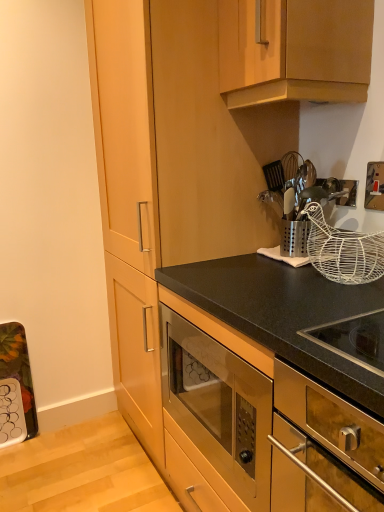
The width and height of the screenshot is (384, 512). What do you see at coordinates (374, 186) in the screenshot?
I see `gold metallic switch at upper right` at bounding box center [374, 186].

Where is `stainless steel oven at lower right`? stainless steel oven at lower right is located at coordinates (323, 449).

From the image's perspective, which is above, metallic silver utensil holder at upper right or wooden cabinet at upper center, the 2th cabinetry ordered from the bottom?

wooden cabinet at upper center, the 2th cabinetry ordered from the bottom, is shown above in the image.

Which point is more distant from viewer, (334, 183) or (353, 50)?

The point (334, 183) is behind.

At what (x,y) coordinates should I click in order to perform the action: click on appliance below the wooden cabinet at upper center, the 2th cabinetry ordered from the bottom (from the image's perspective). Please return your answer as a coordinate pair (x, y). The width and height of the screenshot is (384, 512). Looking at the image, I should click on 299,198.

In the scene shown: Is metallic silver utensil holder at upper right situated inside wooden cabinet at upper center, positioned as the 1th cabinetry in top-to-bottom order, or outside?

metallic silver utensil holder at upper right is located beyond the bounds of wooden cabinet at upper center, positioned as the 1th cabinetry in top-to-bottom order.

Between wooden cabinet at upper center, positioned as the 1th cabinetry in top-to-bottom order, and white wire basket at upper right, which one is positioned behind?

white wire basket at upper right is further away from the camera.

Considering the positions of points (238, 101) and (330, 248), is point (238, 101) farther from camera compared to point (330, 248)?

Yes, it is.

Considering the relative sizes of wooden cabinet at upper center, the 2th cabinetry ordered from the bottom, and white wire basket at upper right in the image provided, is wooden cabinet at upper center, the 2th cabinetry ordered from the bottom, wider than white wire basket at upper right?

Yes.

Looking at this image, is wooden cabinet at upper center, the 2th cabinetry ordered from the bottom, not near white wire basket at upper right?

That's not correct — wooden cabinet at upper center, the 2th cabinetry ordered from the bottom, is a little close to white wire basket at upper right.

Identify the location of cabinetry above the white wire basket at upper right (from a real-world perspective). This screenshot has height=512, width=384. (301, 51).

Measure the distance from white wire basket at upper right to wooden cabinet at upper center, positioned as the 1th cabinetry in top-to-bottom order.

17.57 inches.

Considering the positions of objects white wire basket at upper right and wooden cabinet at upper center, the 2th cabinetry ordered from the bottom, in the image provided, who is more to the left, white wire basket at upper right or wooden cabinet at upper center, the 2th cabinetry ordered from the bottom,?

From the viewer's perspective, wooden cabinet at upper center, the 2th cabinetry ordered from the bottom, appears more on the left side.

Is white wire basket at upper right facing away from wooden cabinet at upper center, positioned as the 1th cabinetry in top-to-bottom order?

No, white wire basket at upper right is not facing away from wooden cabinet at upper center, positioned as the 1th cabinetry in top-to-bottom order.

Based on the photo, is wooden cabinet at upper center, the 2th cabinetry ordered from the bottom, not within stainless steel oven at center, placed as the 1th cabinetry when sorted from bottom to top?

Absolutely, wooden cabinet at upper center, the 2th cabinetry ordered from the bottom, is external to stainless steel oven at center, placed as the 1th cabinetry when sorted from bottom to top.

In the scene shown: Would you say wooden cabinet at upper center, positioned as the 1th cabinetry in top-to-bottom order, is a long distance from stainless steel oven at center, placed as the 1th cabinetry when sorted from bottom to top?

wooden cabinet at upper center, positioned as the 1th cabinetry in top-to-bottom order, is actually quite close to stainless steel oven at center, placed as the 1th cabinetry when sorted from bottom to top.

From the picture: Is wooden cabinet at upper center, the 2th cabinetry ordered from the bottom, in front of or behind stainless steel oven at center, placed as the 1th cabinetry when sorted from bottom to top, in the image?

Clearly, wooden cabinet at upper center, the 2th cabinetry ordered from the bottom, is behind stainless steel oven at center, placed as the 1th cabinetry when sorted from bottom to top.

In the image, is stainless steel oven at center, which is the 2th cabinetry in top-to-bottom order, positioned in front of or behind white wire basket at upper right?

stainless steel oven at center, which is the 2th cabinetry in top-to-bottom order, is in front of white wire basket at upper right.

Which is more distant, (315, 280) or (381, 249)?

Positioned behind is point (315, 280).

Can you confirm if stainless steel oven at center, placed as the 1th cabinetry when sorted from bottom to top, is positioned to the right of white wire basket at upper right?

Result: Incorrect, stainless steel oven at center, placed as the 1th cabinetry when sorted from bottom to top, is not on the right side of white wire basket at upper right.

In the scene shown: What's the angular difference between stainless steel oven at center, which is the 2th cabinetry in top-to-bottom order, and wooden cabinet at upper center, the 2th cabinetry ordered from the bottom,'s facing directions?

0.412 degrees separate the facing orientations of stainless steel oven at center, which is the 2th cabinetry in top-to-bottom order, and wooden cabinet at upper center, the 2th cabinetry ordered from the bottom.

Between stainless steel oven at center, which is the 2th cabinetry in top-to-bottom order, and wooden cabinet at upper center, the 2th cabinetry ordered from the bottom, which one is positioned in front?

stainless steel oven at center, which is the 2th cabinetry in top-to-bottom order, is in front.

Considering the relative positions of stainless steel oven at center, placed as the 1th cabinetry when sorted from bottom to top, and wooden cabinet at upper center, positioned as the 1th cabinetry in top-to-bottom order, in the image provided, is stainless steel oven at center, placed as the 1th cabinetry when sorted from bottom to top, to the left or to the right of wooden cabinet at upper center, positioned as the 1th cabinetry in top-to-bottom order,?

stainless steel oven at center, placed as the 1th cabinetry when sorted from bottom to top, is positioned on wooden cabinet at upper center, positioned as the 1th cabinetry in top-to-bottom order,'s left side.

Considering the relative sizes of stainless steel oven at center, which is the 2th cabinetry in top-to-bottom order, and wooden cabinet at upper center, the 2th cabinetry ordered from the bottom, in the image provided, is stainless steel oven at center, which is the 2th cabinetry in top-to-bottom order, thinner than wooden cabinet at upper center, the 2th cabinetry ordered from the bottom,?

Yes.

Based on the photo, is gold metallic switch at upper right facing away from white wire basket at upper right?

No, gold metallic switch at upper right's orientation is not away from white wire basket at upper right.

From the image's perspective, which object appears higher, gold metallic switch at upper right or white wire basket at upper right?

gold metallic switch at upper right appears higher in the image.

Is gold metallic switch at upper right further to camera compared to white wire basket at upper right?

Yes.

Locate an element on the screen. cabinetry that is the 1st one when counting forward from the metallic silver utensil holder at upper right is located at coordinates (301, 51).

What are the coordinates of `cabinetry above the white wire basket at upper right (from a real-world perspective)` in the screenshot? It's located at (301, 51).

When comparing their distances from stainless steel oven at lower right, does wooden cabinet at upper center, the 2th cabinetry ordered from the bottom, or stainless steel oven at center, placed as the 1th cabinetry when sorted from bottom to top, seem closer?

stainless steel oven at center, placed as the 1th cabinetry when sorted from bottom to top.

Considering their positions, is wooden cabinet at upper center, positioned as the 1th cabinetry in top-to-bottom order, positioned closer to metallic silver utensil holder at upper right than gold metallic switch at upper right?

gold metallic switch at upper right is closer to metallic silver utensil holder at upper right.

Considering their positions, is stainless steel oven at center, which is the 2th cabinetry in top-to-bottom order, positioned closer to stainless steel oven at lower right than metallic silver utensil holder at upper right?

Among the two, stainless steel oven at center, which is the 2th cabinetry in top-to-bottom order, is located nearer to stainless steel oven at lower right.

Estimate the real-world distances between objects in this image. Which object is closer to stainless steel oven at center, which is the 2th cabinetry in top-to-bottom order, white wire basket at upper right or metallic silver utensil holder at upper right?

white wire basket at upper right is closer to stainless steel oven at center, which is the 2th cabinetry in top-to-bottom order.

Looking at this image, looking at the image, which one is located closer to white wire basket at upper right, stainless steel oven at center, placed as the 1th cabinetry when sorted from bottom to top, or metallic silver utensil holder at upper right?

metallic silver utensil holder at upper right lies closer to white wire basket at upper right than the other object.

Considering their positions, is gold metallic switch at upper right positioned further to wooden cabinet at upper center, positioned as the 1th cabinetry in top-to-bottom order, than metallic silver utensil holder at upper right?

gold metallic switch at upper right is positioned further to the anchor wooden cabinet at upper center, positioned as the 1th cabinetry in top-to-bottom order.

When comparing their distances from metallic silver utensil holder at upper right, does white wire basket at upper right or wooden cabinet at upper center, the 2th cabinetry ordered from the bottom, seem closer?

The object closer to metallic silver utensil holder at upper right is white wire basket at upper right.

Looking at the image, which one is located further to stainless steel oven at lower right, stainless steel oven at center, which is the 2th cabinetry in top-to-bottom order, or white wire basket at upper right?

Based on the image, white wire basket at upper right appears to be further to stainless steel oven at lower right.

You are a GUI agent. You are given a task and a screenshot of the screen. Output one action in this format:
    pyautogui.click(x=<x>, y=<y>)
    Task: Click on the basket between metallic silver utensil holder at upper right and stainless steel oven at center, placed as the 1th cabinetry when sorted from bottom to top, in the up-down direction
    The width and height of the screenshot is (384, 512).
    Given the screenshot: What is the action you would take?
    (x=343, y=251)

Find the location of `appliance between gold metallic switch at upper right and stainless steel oven at center, placed as the 1th cabinetry when sorted from bottom to top, in the up-down direction`. appliance between gold metallic switch at upper right and stainless steel oven at center, placed as the 1th cabinetry when sorted from bottom to top, in the up-down direction is located at coordinates (299, 198).

Image resolution: width=384 pixels, height=512 pixels. Find the location of `basket that lies between wooden cabinet at upper center, the 2th cabinetry ordered from the bottom, and stainless steel oven at lower right from top to bottom`. basket that lies between wooden cabinet at upper center, the 2th cabinetry ordered from the bottom, and stainless steel oven at lower right from top to bottom is located at coordinates [343, 251].

This screenshot has width=384, height=512. Identify the location of electric outlet between wooden cabinet at upper center, positioned as the 1th cabinetry in top-to-bottom order, and metallic silver utensil holder at upper right in the up-down direction. (374, 186).